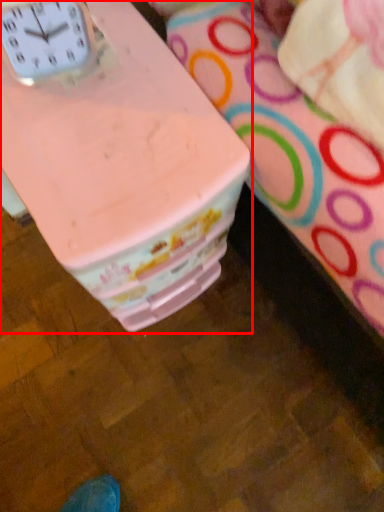
Question: Where is table (annotated by the red box) located in relation to clock in the image?

Choices:
 (A) right
 (B) left

Answer: (A)